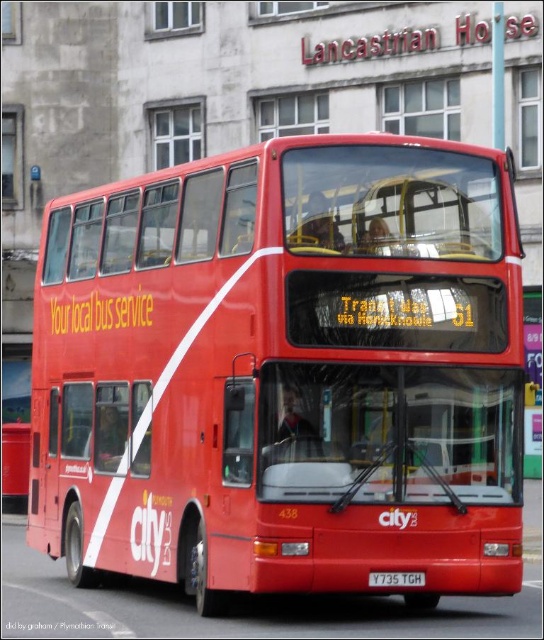
You are a delivery person who needs to place a 10 feet long package between the shiny red bus at center and the black metal license plate at center. Is there enough space?

The distance between the shiny red bus at center and the black metal license plate at center is 9.75 feet. Since the package is 10 feet long, it is slightly longer than the available space, so it won not fit.

You are a city planner trying to determine if the shiny red bus at center can fit through a narrow alley that is only 2 meters wide. The black metal license plate at center is 0.5 meters wide. Can the bus fit through the alley?

The shiny red bus at center is less than 0.5 meters wide, so it can easily fit through the 2 meters wide alley.

You are standing at the back of the bus and want to move to the front. You see two points marked on the bus. Which point should you walk towards first, point at (x=375, y=548) or point at (x=417, y=579)?

You should walk towards point at (x=375, y=548) first because it is in front of point at (x=417, y=579).